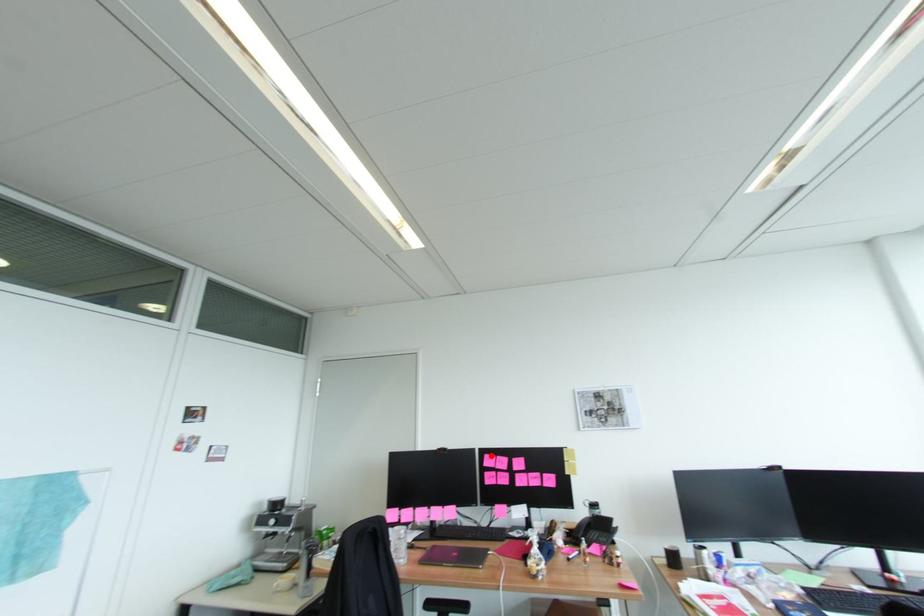
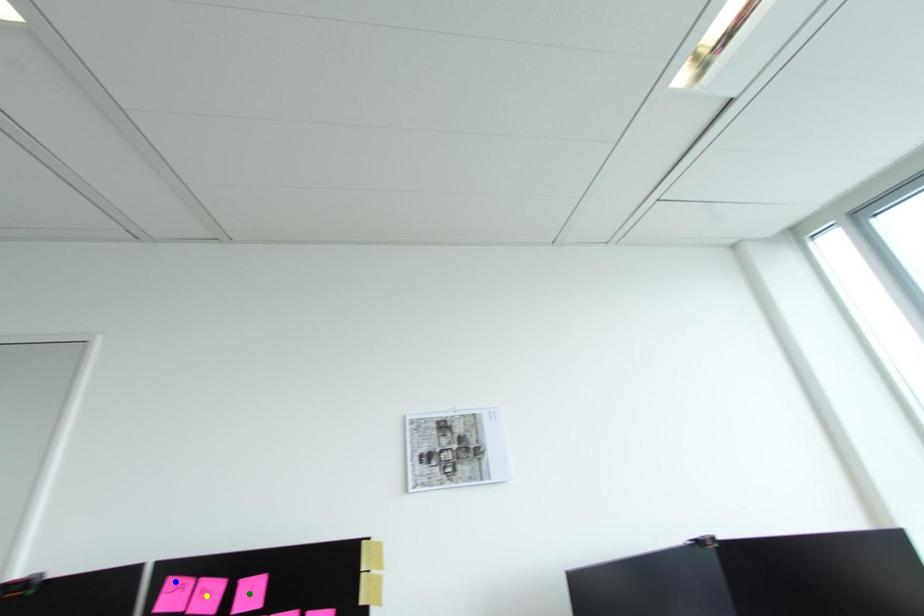
Question: I am providing you with two images of the same scene from different viewpoints. A red point is marked on the first image. You are given multiple points on the second image. In image 2, which mark is for the same physical point as the one in image 1?

Choices:
 (A) blue point
 (B) green point
 (C) yellow point

Answer: (A)